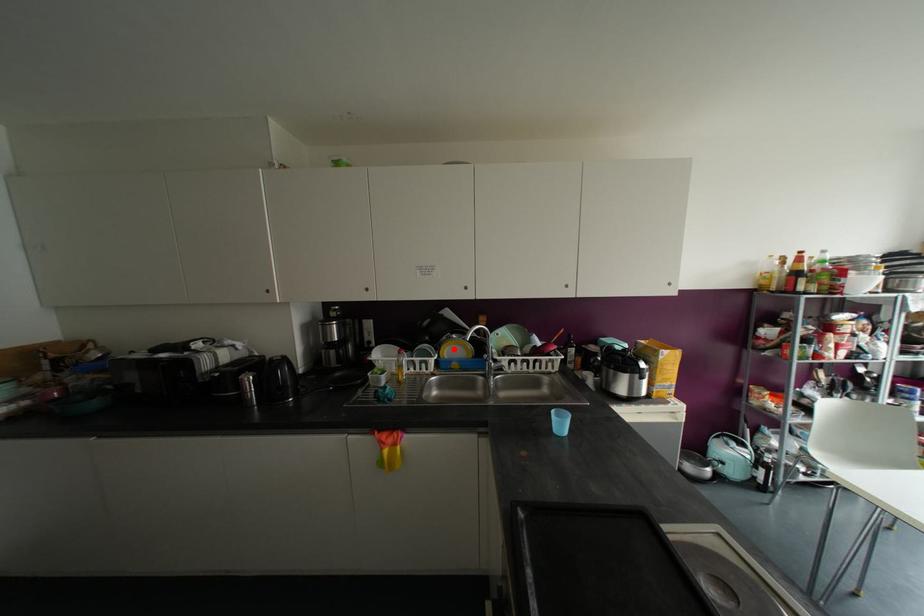
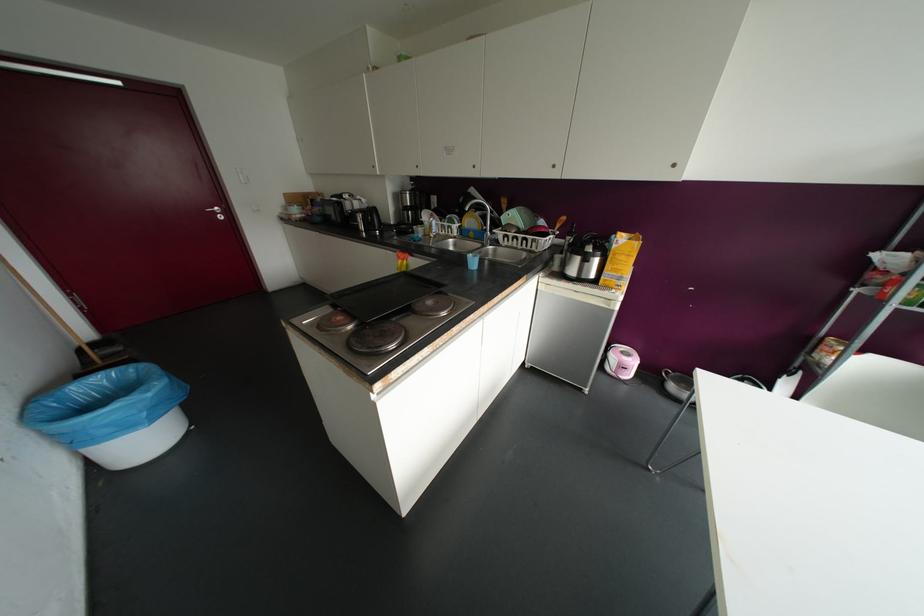
Question: I am providing you with two images of the same scene from different viewpoints. A red point is shown in image1. For the corresponding object point in image2, is it positioned nearer or farther from the camera?

Choices:
 (A) Nearer
 (B) Farther

Answer: (A)